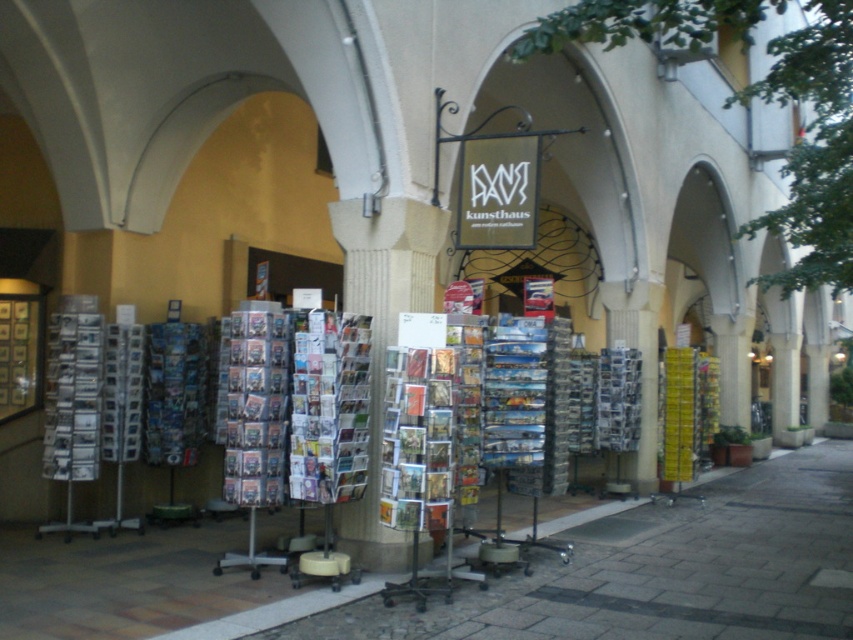
You are a delivery person trying to place a heavy box on the smooth stone pavement at center. However, there are printed paper cards at center in the way. Can you easily slide the cards aside to make space?

The smooth stone pavement at center has a lesser height compared to printed paper cards at center. Since the pavement is lower, you can easily slide the printed paper cards at center aside to make space for the box.

You are a delivery person who needs to place a heavy box on the ground near the printed paper cards at center. According to the scene, where should you place the box to ensure it stays on the smooth stone pavement at center?

The smooth stone pavement at center is located below the printed paper cards at center, so you should place the box directly under the printed paper cards at center to ensure it stays on the smooth stone pavement at center.

Consider the image. You are standing at the entrance of the Kunst Haus and want to place a new stand in the exact center of the smooth stone pavement at center. According to the coordinates provided, where should you position the stand?

The smooth stone pavement at center is located at the coordinates point [490,579], so you should position the stand at that exact point.